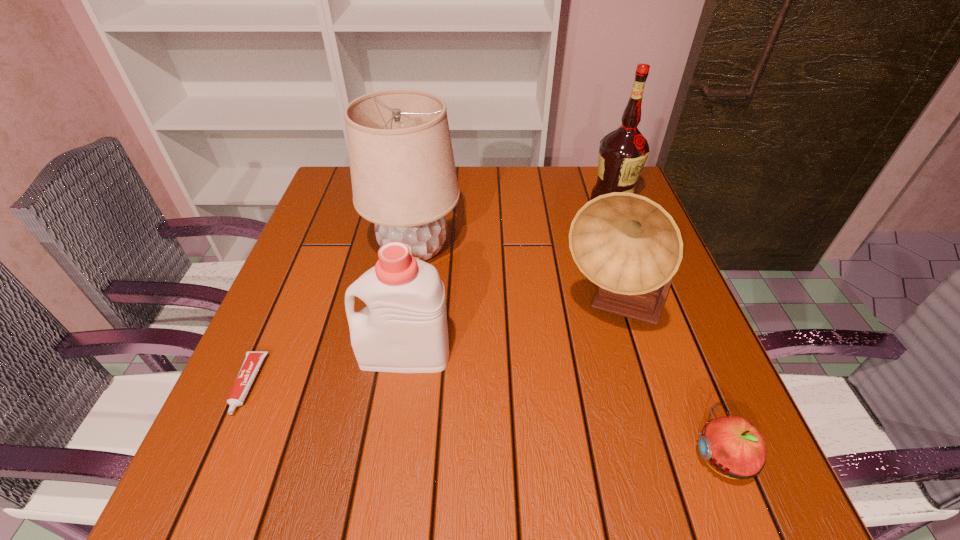
The width and height of the screenshot is (960, 540). In order to click on object that can be found as the fourth closest to the lampshade in this screenshot , I will do `click(623, 152)`.

Select which object appears as the closest to the lampshade. Please provide its 2D coordinates. Your answer should be formatted as a tuple, i.e. [(x, y)], where the tuple contains the x and y coordinates of a point satisfying the conditions above.

[(403, 329)]

You are a GUI agent. You are given a task and a screenshot of the screen. Output one action in this format:
    pyautogui.click(x=<x>, y=<y>)
    Task: Click on the free space that satisfies the following two spatial constraints: 1. on the handle side of the second shortest object; 2. on the right side of the fourth tallest object
    
    Given the screenshot: What is the action you would take?
    pyautogui.click(x=390, y=457)

The height and width of the screenshot is (540, 960). I want to click on free location that satisfies the following two spatial constraints: 1. on the label of the farthest object; 2. on the left side of the second shortest object, so click(x=708, y=457).

Locate an element on the screen. The height and width of the screenshot is (540, 960). vacant area that satisfies the following two spatial constraints: 1. on the handle side of the detergent; 2. at the nozzle of the shortest object is located at coordinates (400, 384).

Where is `vacant space that satisfies the following two spatial constraints: 1. on the handle side of the detergent; 2. on the right side of the nearest object`? The height and width of the screenshot is (540, 960). vacant space that satisfies the following two spatial constraints: 1. on the handle side of the detergent; 2. on the right side of the nearest object is located at coordinates (390, 457).

Locate an element on the screen. free region that satisfies the following two spatial constraints: 1. on the horn of the phonograph record; 2. on the right side of the apple is located at coordinates (659, 457).

Identify the location of free spot that satisfies the following two spatial constraints: 1. on the label of the farthest object; 2. on the handle side of the detergent. (669, 354).

The height and width of the screenshot is (540, 960). I want to click on free space that satisfies the following two spatial constraints: 1. on the horn of the phonograph record; 2. on the handle side of the third shortest object, so click(x=628, y=354).

Find the location of a particular element. free point that satisfies the following two spatial constraints: 1. on the handle side of the detergent; 2. at the nozzle of the shortest object is located at coordinates (400, 384).